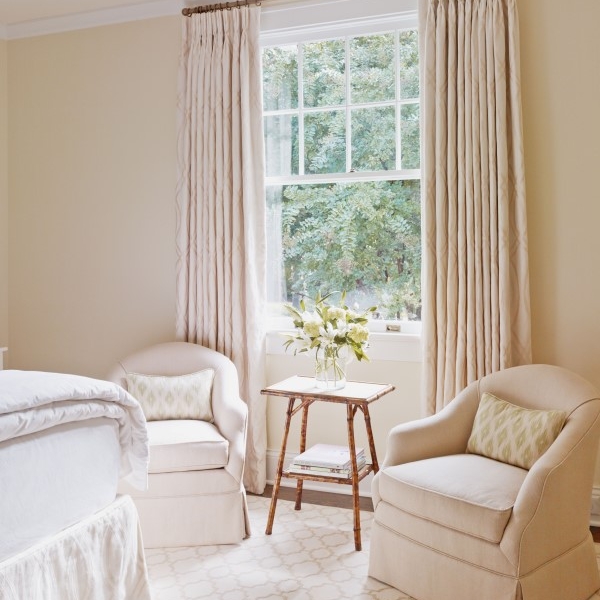
Where is `coffee table books`? This screenshot has width=600, height=600. coffee table books is located at coordinates (321, 455), (325, 467), (325, 472).